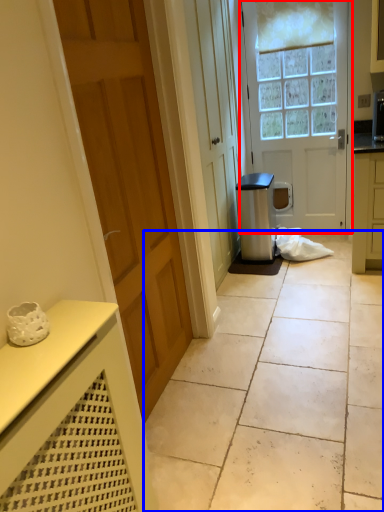
Question: Which of the following is the closest to the observer, door (highlighted by a red box) or concrete (highlighted by a blue box)?

Choices:
 (A) door
 (B) concrete

Answer: (B)